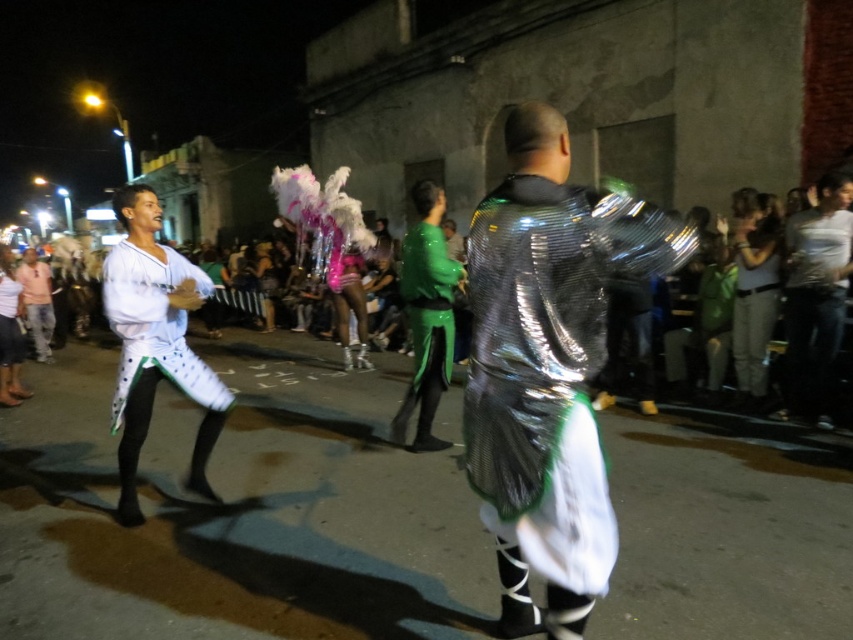
You are standing at the center of the street looking towards the building. There is a point marked at coordinates (747, 353). What object is located at that point?

The object located at point (747, 353) is the matte green pants at lower center.

You are a photographer trying to capture both the matte green pants at lower center and the green glossy suit at center in a single frame. Which object should you focus on first to ensure both are in focus?

You should focus on the matte green pants at lower center first since it is closer to the camera than the green glossy suit at center. By focusing on the closer object, the background object will still be within the depth of field, ensuring both are in focus.

You are a photographer trying to capture the festive atmosphere. You notice the white matte pants at center and the green glossy suit at center in your viewfinder. Which object should you focus on if you want to highlight the lower part of the scene?

The white matte pants at center is below the green glossy suit at center, so focusing on the white matte pants at center would highlight the lower part of the scene.